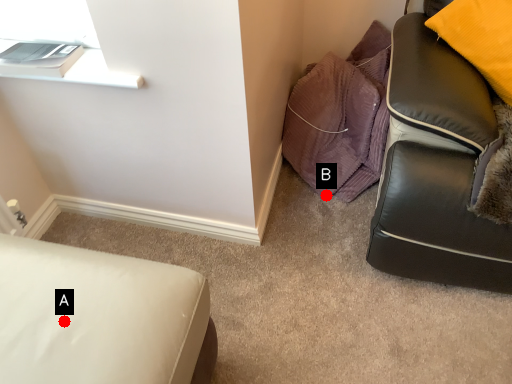
Question: Two points are circled on the image, labeled by A and B beside each circle. Which point is farther from the camera taking this photo?

Choices:
 (A) A is further
 (B) B is further

Answer: (B)